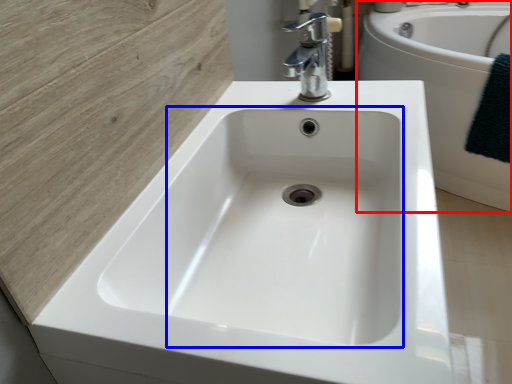
Question: Which of the following is the farthest to the observer, bath (highlighted by a red box) or sink (highlighted by a blue box)?

Choices:
 (A) bath
 (B) sink

Answer: (A)